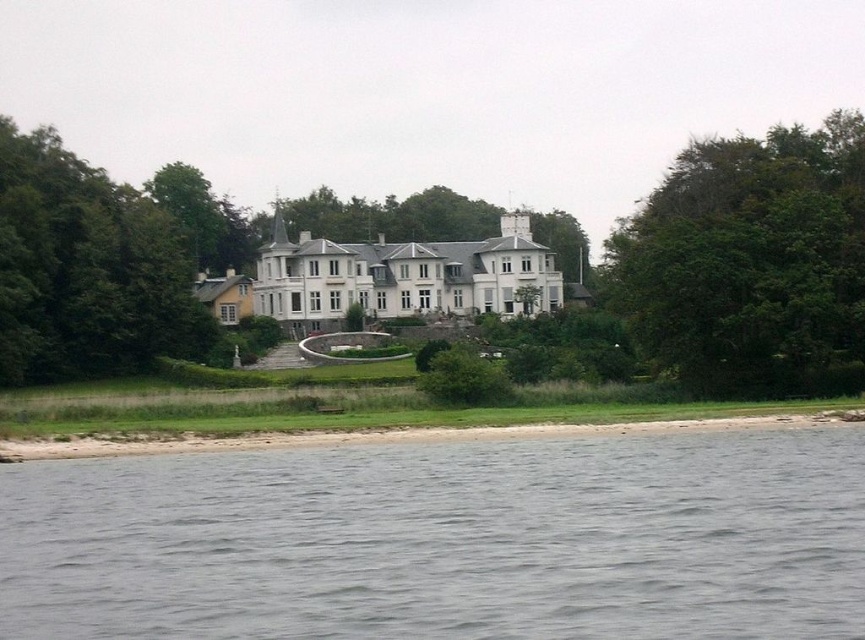
Which of these two, white smooth mansion at center or smooth sand shoreline at lower center, stands shorter?

smooth sand shoreline at lower center

Which is in front, point (459, 269) or point (614, 426)?

Point (614, 426) is more forward.

Image resolution: width=865 pixels, height=640 pixels. I want to click on white smooth mansion at center, so click(402, 276).

Is gray water at lower left further to the viewer compared to smooth sand shoreline at lower center?

No, gray water at lower left is in front of smooth sand shoreline at lower center.

Who is lower down, gray water at lower left or smooth sand shoreline at lower center?

gray water at lower left is lower down.

Measure the distance between gray water at lower left and camera.

27.38 meters

Locate an element on the screen. gray water at lower left is located at coordinates (445, 540).

Who is positioned more to the right, green leafy tree at right or green leafy tree at left?

Positioned to the right is green leafy tree at right.

Which is behind, point (616, 250) or point (3, 182)?

Positioned behind is point (616, 250).

The height and width of the screenshot is (640, 865). I want to click on green leafy tree at right, so coord(748,260).